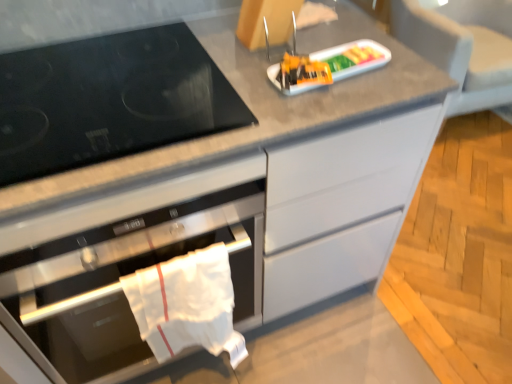
Question: Is the surface of black glass gas stove at left in direct contact with white cloth towel at lower left?

Choices:
 (A) yes
 (B) no

Answer: (B)

Question: Considering the relative sizes of black glass gas stove at left and white cloth towel at lower left in the image provided, is black glass gas stove at left smaller than white cloth towel at lower left?

Choices:
 (A) yes
 (B) no

Answer: (B)

Question: Is black glass gas stove at left oriented away from white cloth towel at lower left?

Choices:
 (A) no
 (B) yes

Answer: (A)

Question: From the image's perspective, is black glass gas stove at left on white cloth towel at lower left?

Choices:
 (A) yes
 (B) no

Answer: (A)

Question: Does black glass gas stove at left come in front of white cloth towel at lower left?

Choices:
 (A) no
 (B) yes

Answer: (B)

Question: Is black glass gas stove at left not near white cloth towel at lower left?

Choices:
 (A) yes
 (B) no

Answer: (B)

Question: Is the surface of plastic tray at center in direct contact with black glass gas stove at left?

Choices:
 (A) no
 (B) yes

Answer: (A)

Question: Is plastic tray at center facing towards black glass gas stove at left?

Choices:
 (A) no
 (B) yes

Answer: (A)

Question: Is black glass gas stove at left at the back of plastic tray at center?

Choices:
 (A) yes
 (B) no

Answer: (B)

Question: From a real-world perspective, is plastic tray at center below black glass gas stove at left?

Choices:
 (A) no
 (B) yes

Answer: (A)

Question: Can you confirm if plastic tray at center is bigger than black glass gas stove at left?

Choices:
 (A) yes
 (B) no

Answer: (B)

Question: Does plastic tray at center come behind black glass gas stove at left?

Choices:
 (A) no
 (B) yes

Answer: (B)

Question: From a real-world perspective, is white cloth towel at lower left positioned over plastic tray at center based on gravity?

Choices:
 (A) yes
 (B) no

Answer: (B)